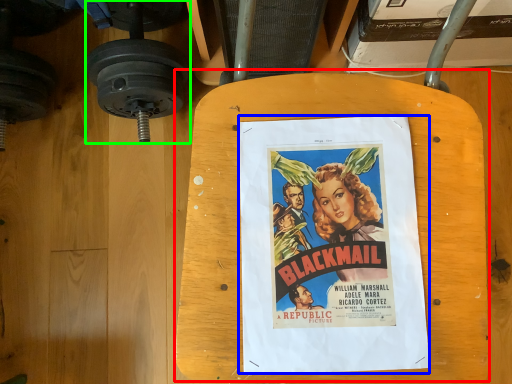
Question: Considering the real-world distances, which object is closest to table (highlighted by a red box)? poster (highlighted by a blue box) or dumbbell (highlighted by a green box).

Choices:
 (A) poster
 (B) dumbbell

Answer: (A)